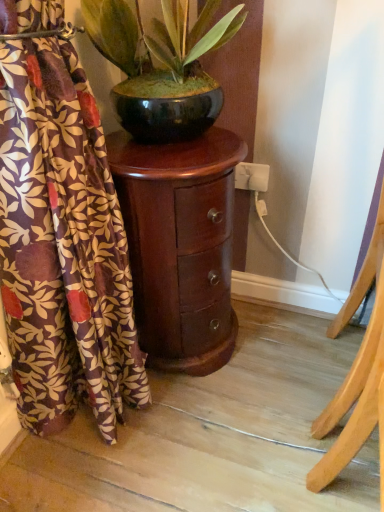
Question: Is matte floral curtain at left closer to camera compared to shiny black pot at upper center?

Choices:
 (A) yes
 (B) no

Answer: (A)

Question: Is matte floral curtain at left next to shiny black pot at upper center?

Choices:
 (A) no
 (B) yes

Answer: (A)

Question: From a real-world perspective, is matte floral curtain at left positioned under shiny black pot at upper center based on gravity?

Choices:
 (A) yes
 (B) no

Answer: (A)

Question: From the image's perspective, is matte floral curtain at left over shiny black pot at upper center?

Choices:
 (A) no
 (B) yes

Answer: (A)

Question: Is matte floral curtain at left far away from shiny black pot at upper center?

Choices:
 (A) no
 (B) yes

Answer: (A)

Question: Is shiny dark wood nightstand at center taller or shorter than light wood easel at right?

Choices:
 (A) tall
 (B) short

Answer: (B)

Question: From a real-world perspective, is shiny dark wood nightstand at center positioned above or below light wood easel at right?

Choices:
 (A) below
 (B) above

Answer: (A)

Question: In the image, is shiny dark wood nightstand at center on the left side or the right side of light wood easel at right?

Choices:
 (A) right
 (B) left

Answer: (B)

Question: Relative to light wood easel at right, is shiny dark wood nightstand at center in front or behind?

Choices:
 (A) behind
 (B) front

Answer: (A)

Question: Considering the positions of matte floral curtain at left and light wood easel at right in the image, is matte floral curtain at left bigger or smaller than light wood easel at right?

Choices:
 (A) small
 (B) big

Answer: (B)

Question: Considering the positions of matte floral curtain at left and light wood easel at right in the image, is matte floral curtain at left taller or shorter than light wood easel at right?

Choices:
 (A) tall
 (B) short

Answer: (B)

Question: Considering the positions of point (9, 121) and point (370, 271), is point (9, 121) closer or farther from the camera than point (370, 271)?

Choices:
 (A) farther
 (B) closer

Answer: (B)

Question: Do you think matte floral curtain at left is within light wood easel at right, or outside of it?

Choices:
 (A) outside
 (B) inside

Answer: (A)

Question: Is point (140, 73) closer or farther from the camera than point (51, 222)?

Choices:
 (A) closer
 (B) farther

Answer: (B)

Question: In terms of width, does shiny black pot at upper center look wider or thinner when compared to matte floral curtain at left?

Choices:
 (A) wide
 (B) thin

Answer: (A)